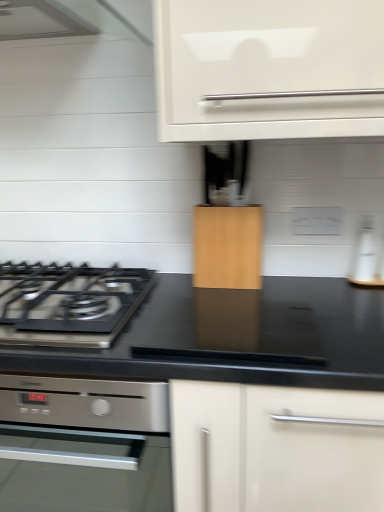
Question: Is wooden cabinet at center closer to camera compared to white glossy bottle at right?

Choices:
 (A) no
 (B) yes

Answer: (B)

Question: Considering the relative sizes of wooden cabinet at center and white glossy bottle at right in the image provided, is wooden cabinet at center shorter than white glossy bottle at right?

Choices:
 (A) yes
 (B) no

Answer: (B)

Question: Is wooden cabinet at center to the right of white glossy bottle at right from the viewer's perspective?

Choices:
 (A) no
 (B) yes

Answer: (A)

Question: Is wooden cabinet at center at the left side of white glossy bottle at right?

Choices:
 (A) no
 (B) yes

Answer: (B)

Question: Is wooden cabinet at center surrounding white glossy bottle at right?

Choices:
 (A) no
 (B) yes

Answer: (A)

Question: Is point (365, 248) positioned closer to the camera than point (127, 304)?

Choices:
 (A) closer
 (B) farther

Answer: (B)

Question: Considering the positions of white glossy bottle at right and black matte gas stove at left in the image, is white glossy bottle at right bigger or smaller than black matte gas stove at left?

Choices:
 (A) big
 (B) small

Answer: (B)

Question: Is white glossy bottle at right wider or thinner than black matte gas stove at left?

Choices:
 (A) wide
 (B) thin

Answer: (B)

Question: Is white glossy bottle at right in front of or behind black matte gas stove at left in the image?

Choices:
 (A) behind
 (B) front

Answer: (A)

Question: From the image's perspective, relative to white glossy bottle at right, is satin silver oven at lower left above or below?

Choices:
 (A) below
 (B) above

Answer: (A)

Question: In the image, is satin silver oven at lower left positioned in front of or behind white glossy bottle at right?

Choices:
 (A) front
 (B) behind

Answer: (A)

Question: Would you say satin silver oven at lower left is to the left or to the right of white glossy bottle at right in the picture?

Choices:
 (A) left
 (B) right

Answer: (A)

Question: Looking at the image, does satin silver oven at lower left seem bigger or smaller compared to white glossy bottle at right?

Choices:
 (A) big
 (B) small

Answer: (A)

Question: In terms of height, does black matte gas stove at left look taller or shorter compared to satin silver oven at lower left?

Choices:
 (A) tall
 (B) short

Answer: (B)

Question: Is black matte gas stove at left inside the boundaries of satin silver oven at lower left, or outside?

Choices:
 (A) outside
 (B) inside

Answer: (A)